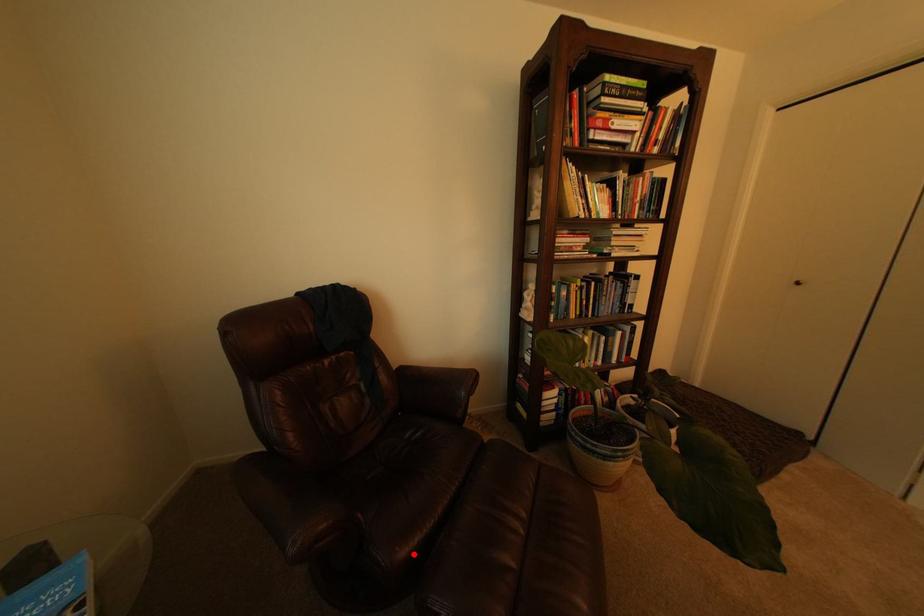
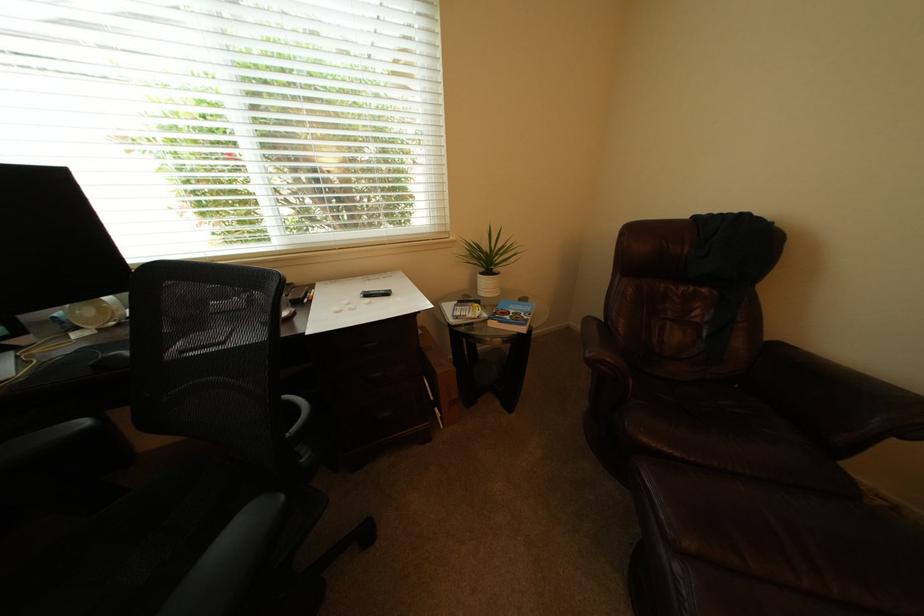
Where in the second image is the point corresponding to the highlighted location from the first image?

(657, 440)